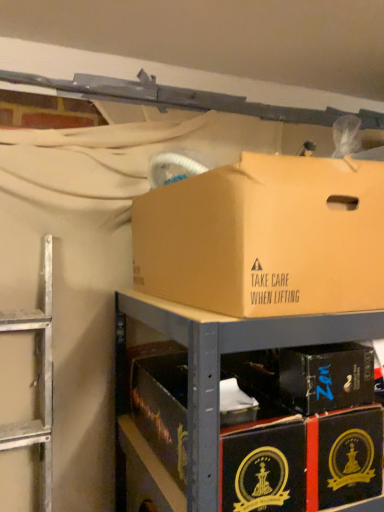
Question: From a real-world perspective, relative to black cardboard box at center, which is the 1th box from bottom to top, is brown cardboard box at upper center, which is the second box from bottom to top, vertically above or below?

Choices:
 (A) below
 (B) above

Answer: (B)

Question: Does point (297, 218) appear closer or farther from the camera than point (306, 395)?

Choices:
 (A) farther
 (B) closer

Answer: (B)

Question: Estimate the real-world distances between objects in this image. Which object is farther from the brown cardboard box at upper center, marked as the 1th box in a top-to-bottom arrangement?

Choices:
 (A) black cardboard box at center, the second box viewed from the top
 (B) black cardboard boxes at lower right

Answer: (A)

Question: Which object is positioned farthest from the black cardboard box at center, which is the 1th box from bottom to top?

Choices:
 (A) black cardboard boxes at lower right
 (B) brown cardboard box at upper center, marked as the 1th box in a top-to-bottom arrangement

Answer: (B)